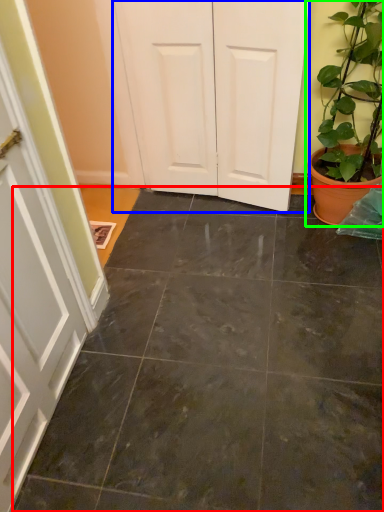
Question: Estimate the real-world distances between objects in this image. Which object is closer to concrete (highlighted by a red box), door (highlighted by a blue box) or houseplant (highlighted by a green box)?

Choices:
 (A) door
 (B) houseplant

Answer: (B)